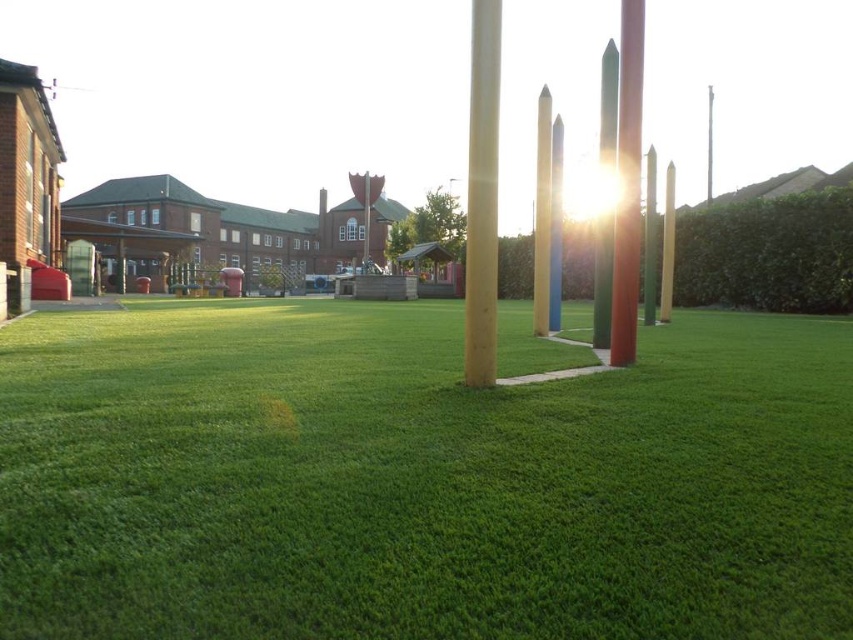
Is smooth green pole at center to the left of smooth red pole at center from the viewer's perspective?

Correct, you'll find smooth green pole at center to the left of smooth red pole at center.

Between smooth green pole at center and smooth red pole at center, which one has more height?

smooth red pole at center

What do you see at coordinates (648, 240) in the screenshot? This screenshot has height=640, width=853. I see `smooth green pole at center` at bounding box center [648, 240].

I want to click on smooth green pole at center, so click(648, 240).

Between point (515, 483) and point (537, 211), which one is positioned in front?

Point (515, 483) is in front.

Does point (109, 532) come closer to viewer compared to point (538, 300)?

That is True.

Find the location of `green artificial turf at center`. green artificial turf at center is located at coordinates (416, 481).

Does matte wood pole at center appear on the right side of green polished pole at center?

Incorrect, matte wood pole at center is not on the right side of green polished pole at center.

Does matte wood pole at center have a greater height compared to green polished pole at center?

No.

I want to click on matte wood pole at center, so click(482, 195).

This screenshot has width=853, height=640. Find the location of `matte wood pole at center`. matte wood pole at center is located at coordinates (482, 195).